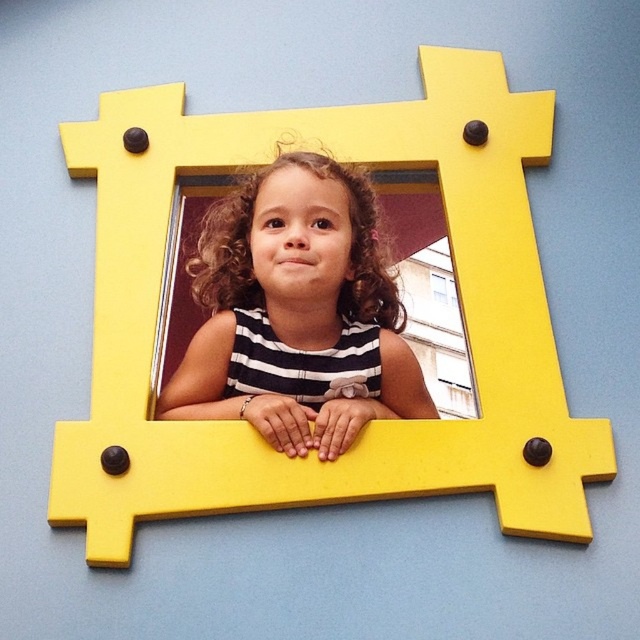
Question: Is black striped shirt at center further to camera compared to transparent glass window at center?

Choices:
 (A) no
 (B) yes

Answer: (A)

Question: Does black striped shirt at center have a lesser width compared to transparent glass window at center?

Choices:
 (A) no
 (B) yes

Answer: (A)

Question: Which of the following is the closest to the observer?

Choices:
 (A) transparent glass window at center
 (B) black striped shirt at center

Answer: (B)

Question: Which point appears closest to the camera in this image?

Choices:
 (A) (230, 369)
 (B) (451, 280)

Answer: (A)

Question: Can you confirm if black striped shirt at center is positioned to the right of transparent glass window at center?

Choices:
 (A) yes
 (B) no

Answer: (B)